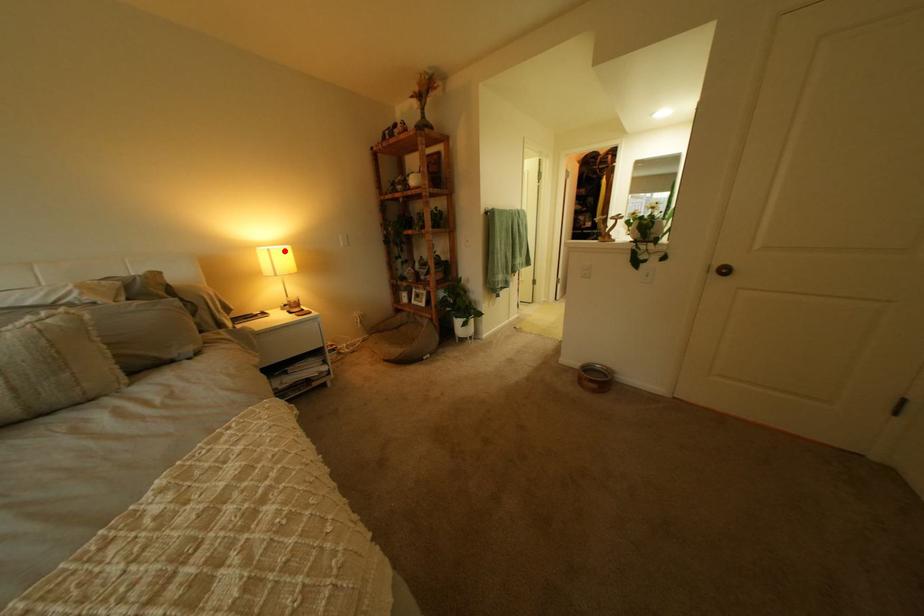
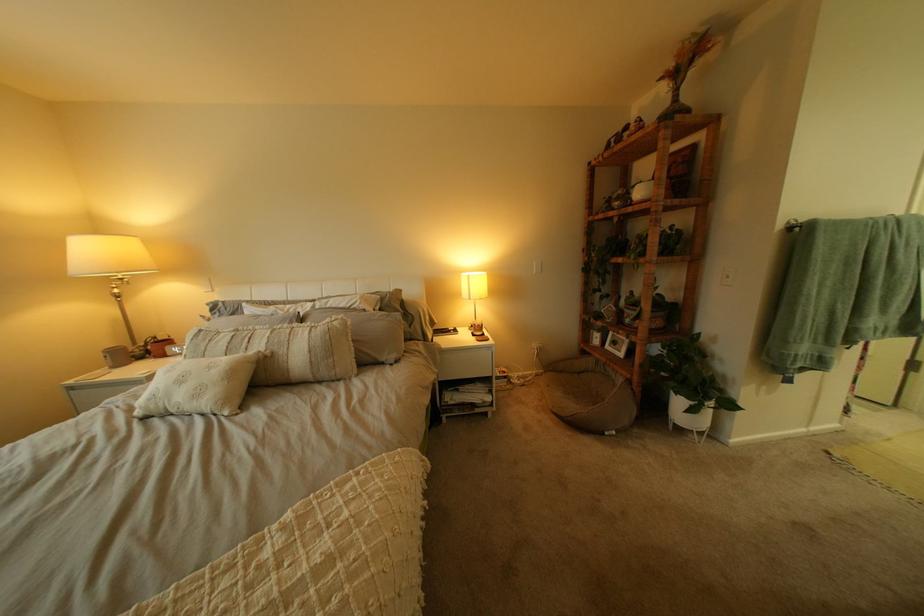
Question: I am providing you with two images of the same scene from different viewpoints. Given a red point in image1, look at the same physical point in image2. Is it:

Choices:
 (A) Closer to the viewpoint
 (B) Farther from the viewpoint

Answer: (B)